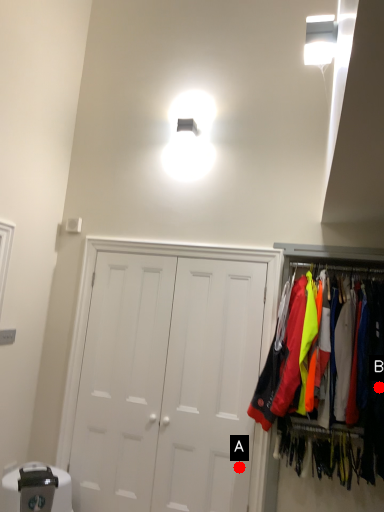
Question: Two points are circled on the image, labeled by A and B beside each circle. Which point appears closest to the camera in this image?

Choices:
 (A) A is closer
 (B) B is closer

Answer: (B)